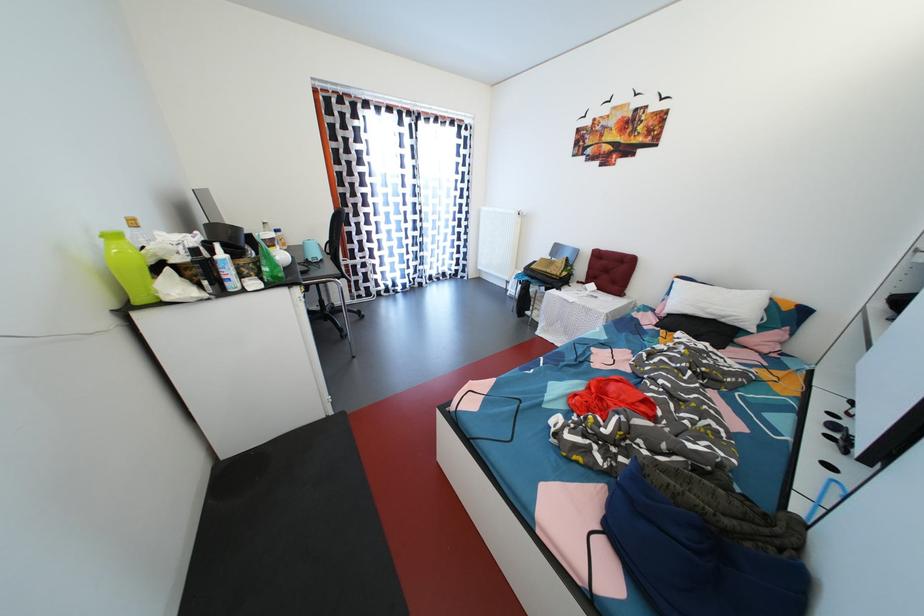
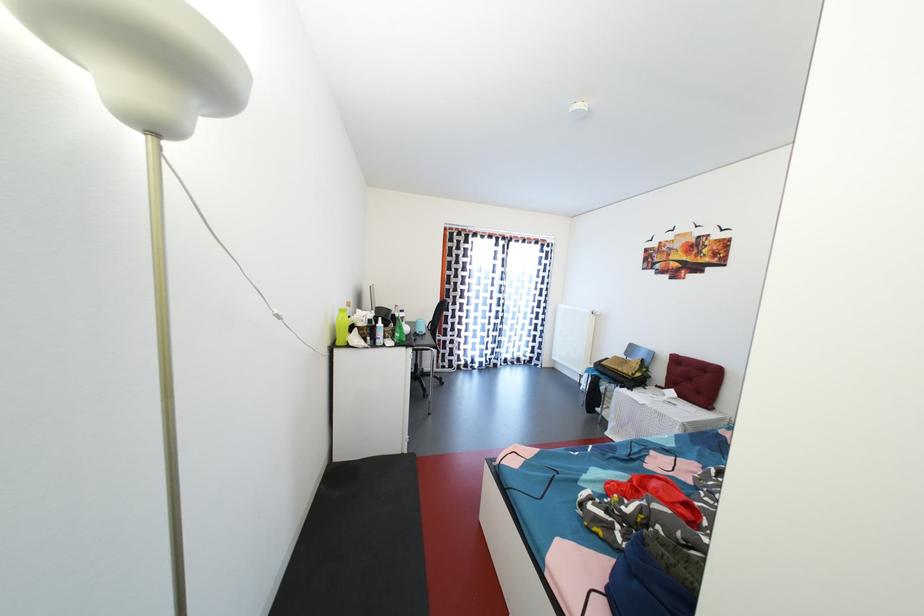
Where in the second image is the point corresponding to (x=201, y=256) from the first image?

(377, 326)